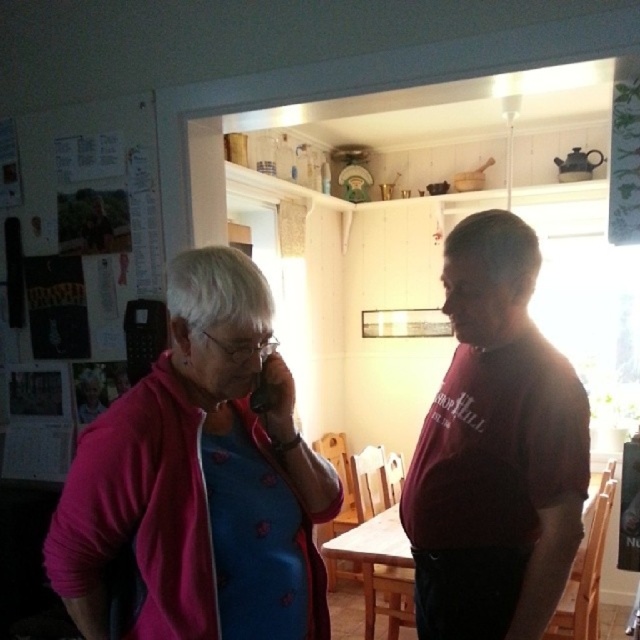
Question: Does pink fabric at left have a greater width compared to maroon cotton shirt at center?

Choices:
 (A) no
 (B) yes

Answer: (B)

Question: Estimate the real-world distances between objects in this image. Which object is closer to the pink fabric at left?

Choices:
 (A) maroon cotton shirt at center
 (B) pink fabric jacket at center

Answer: (A)

Question: Can you confirm if pink fabric jacket at center is positioned to the left of maroon cotton shirt at center?

Choices:
 (A) no
 (B) yes

Answer: (A)

Question: Which of these objects is positioned farthest from the pink fabric jacket at center?

Choices:
 (A) pink fabric at left
 (B) maroon cotton shirt at center

Answer: (A)

Question: Which point is closer to the camera?

Choices:
 (A) (528, 419)
 (B) (253, 269)
 (C) (570, 408)

Answer: (B)

Question: Is pink fabric at left closer to the viewer compared to maroon cotton shirt at center?

Choices:
 (A) yes
 (B) no

Answer: (A)